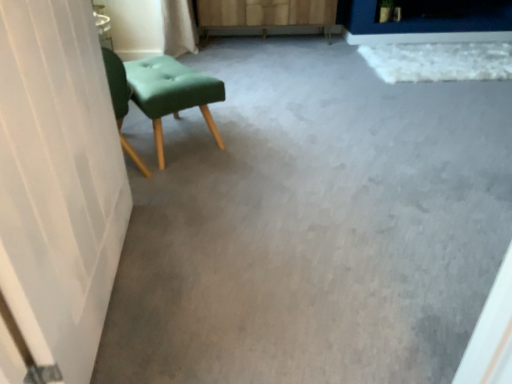
What are the coordinates of `matte green fabric stool at left` in the screenshot? It's located at (170, 93).

Measure the distance between point (x=292, y=216) and camera.

A distance of 1.55 meters exists between point (x=292, y=216) and camera.

Identify the location of wooden dresser at center. (266, 17).

Who is taller, wooden dresser at center or matte gray carpet at center?

With more height is wooden dresser at center.

Measure the distance from wooden dresser at center to matte gray carpet at center.

wooden dresser at center and matte gray carpet at center are 1.93 meters apart.

Can you confirm if wooden dresser at center is positioned to the left of matte gray carpet at center?

Yes.

Can you confirm if wooden dresser at center is thinner than matte gray carpet at center?

Yes.

Would you say matte gray carpet at center is a long distance from matte green fabric stool at left?

matte gray carpet at center is actually quite close to matte green fabric stool at left.

At what (x,y) coordinates should I click in order to perform the action: click on stool located below the matte gray carpet at center (from the image's perspective). Please return your answer as a coordinate pair (x, y). This screenshot has width=512, height=384. Looking at the image, I should click on (170, 93).

Looking at this image, from a real-world perspective, relative to matte green fabric stool at left, is matte gray carpet at center vertically above or below?

Clearly, from a real-world perspective, matte gray carpet at center is below matte green fabric stool at left.

Is point (342, 248) positioned in front of point (179, 102)?

Yes, it is.

Is point (354, 104) less distant than point (233, 29)?

Yes.

Is the surface of matte gray carpet at center in direct contact with wooden dresser at center?

matte gray carpet at center is not next to wooden dresser at center, and they're not touching.

This screenshot has width=512, height=384. Find the location of `dresser to the left of matte gray carpet at center`. dresser to the left of matte gray carpet at center is located at coordinates (266, 17).

How many degrees apart are the facing directions of matte gray carpet at center and wooden dresser at center?

matte gray carpet at center and wooden dresser at center are facing 0.515 degrees away from each other.

Looking at this image, is matte green fabric stool at left at the back of wooden dresser at center?

No.

From the image's perspective, is wooden dresser at center beneath matte green fabric stool at left?

No.

Is wooden dresser at center smaller than matte green fabric stool at left?

Incorrect, wooden dresser at center is not smaller in size than matte green fabric stool at left.

Considering the relative sizes of matte green fabric stool at left and wooden dresser at center in the image provided, is matte green fabric stool at left wider than wooden dresser at center?

No.

From the image's perspective, would you say matte green fabric stool at left is positioned over wooden dresser at center?

No.

Could you tell me if matte green fabric stool at left is facing wooden dresser at center?

No, matte green fabric stool at left is not aimed at wooden dresser at center.

Which object is positioned more to the right, matte green fabric stool at left or wooden dresser at center?

From the viewer's perspective, wooden dresser at center appears more on the right side.

Based on the photo, could you tell me if matte green fabric stool at left is facing matte gray carpet at center?

Yes.

Which of these two, matte green fabric stool at left or matte gray carpet at center, stands shorter?

matte gray carpet at center.

Considering the relative sizes of matte green fabric stool at left and matte gray carpet at center in the image provided, is matte green fabric stool at left wider than matte gray carpet at center?

No.

This screenshot has height=384, width=512. What are the coordinates of `concrete on the right of wooden dresser at center` in the screenshot? It's located at (311, 225).

You are a GUI agent. You are given a task and a screenshot of the screen. Output one action in this format:
    pyautogui.click(x=<x>, y=<y>)
    Task: Click on the stool below the matte gray carpet at center (from the image's perspective)
    
    Given the screenshot: What is the action you would take?
    pyautogui.click(x=170, y=93)

Looking at the image, which one is located closer to matte gray carpet at center, wooden dresser at center or matte green fabric stool at left?

Among the two, matte green fabric stool at left is located nearer to matte gray carpet at center.

When comparing their distances from matte green fabric stool at left, does wooden dresser at center or matte gray carpet at center seem further?

wooden dresser at center is positioned further to the anchor matte green fabric stool at left.

Based on their spatial positions, is matte gray carpet at center or matte green fabric stool at left further from wooden dresser at center?

Among the two, matte gray carpet at center is located further to wooden dresser at center.

When comparing their distances from wooden dresser at center, does matte green fabric stool at left or matte gray carpet at center seem further?

The object further to wooden dresser at center is matte gray carpet at center.

Looking at this image, which object lies nearer to the anchor point matte gray carpet at center, matte green fabric stool at left or wooden dresser at center?

matte green fabric stool at left.

When comparing their distances from matte green fabric stool at left, does matte gray carpet at center or wooden dresser at center seem further?

wooden dresser at center is positioned further to the anchor matte green fabric stool at left.

You are a GUI agent. You are given a task and a screenshot of the screen. Output one action in this format:
    pyautogui.click(x=<x>, y=<y>)
    Task: Click on the stool between matte gray carpet at center and wooden dresser at center from front to back
    Image resolution: width=512 pixels, height=384 pixels.
    Given the screenshot: What is the action you would take?
    pyautogui.click(x=170, y=93)